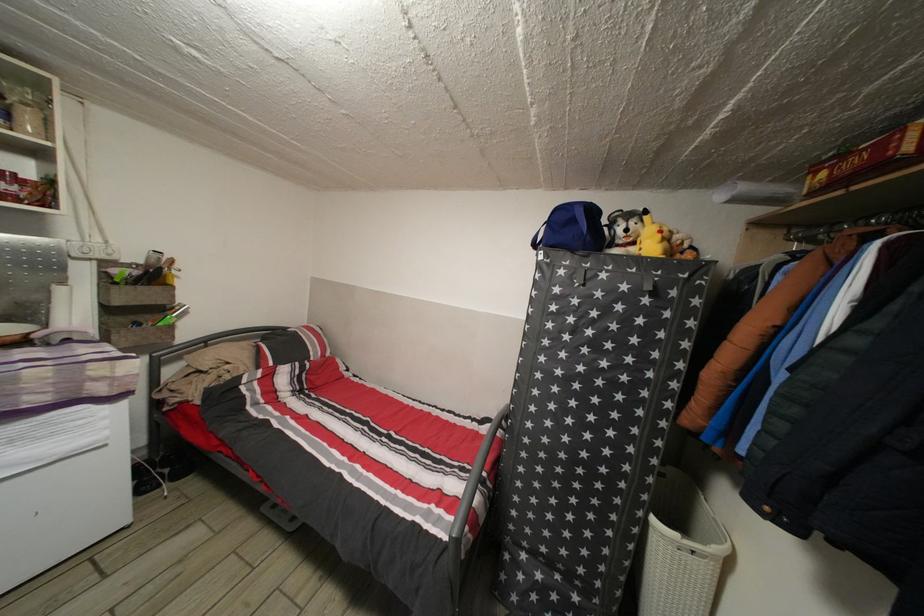
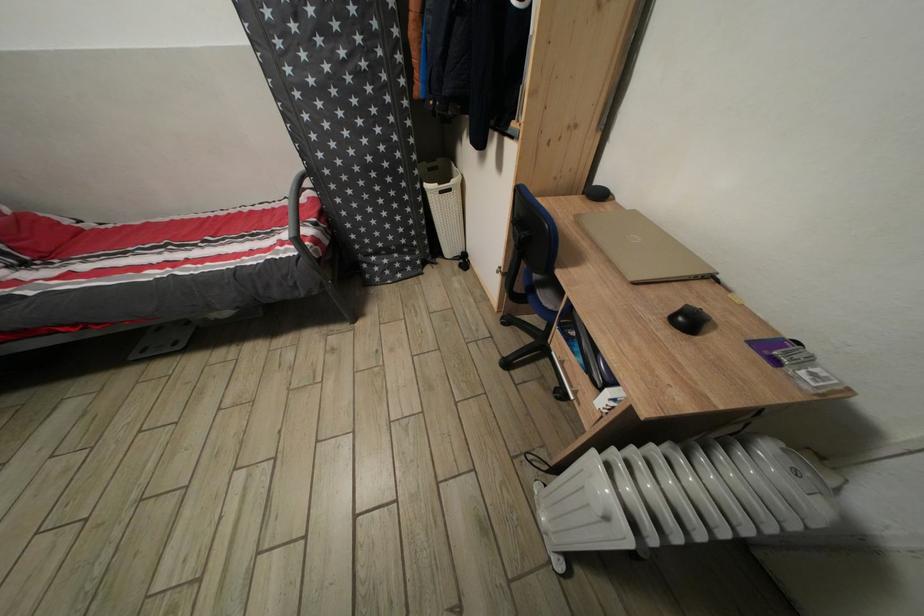
Locate, in the second image, the point that corresponds to pixel 475 430 in the first image.

(294, 209)